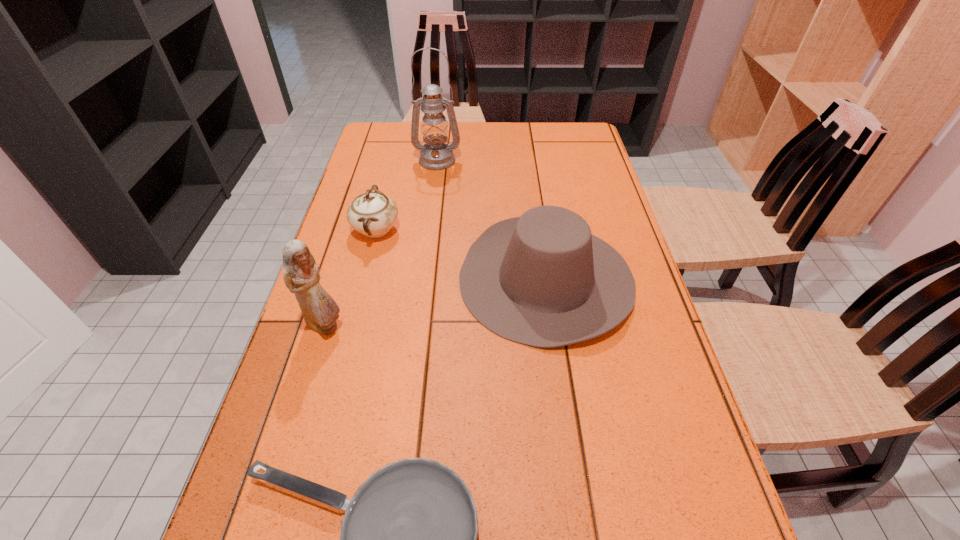
Find the location of a particular element. The width and height of the screenshot is (960, 540). object that stands as the second closest to the nearest object is located at coordinates (301, 276).

You are a GUI agent. You are given a task and a screenshot of the screen. Output one action in this format:
    pyautogui.click(x=<x>, y=<y>)
    Task: Click on the object that is the second closest to the second shortest object
    
    Given the screenshot: What is the action you would take?
    pyautogui.click(x=301, y=276)

I want to click on vacant area in the image that satisfies the following two spatial constraints: 1. on the back side of the second shortest object; 2. on the left side of the tallest object, so click(394, 160).